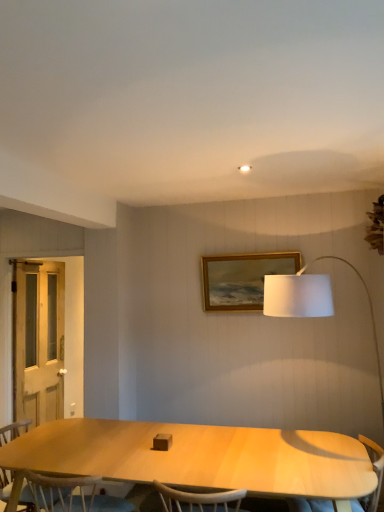
Question: Does point (26, 281) appear closer or farther from the camera than point (377, 457)?

Choices:
 (A) farther
 (B) closer

Answer: (A)

Question: From a real-world perspective, relative to light wood armchair at lower right, is white wooden screen door at left vertically above or below?

Choices:
 (A) below
 (B) above

Answer: (B)

Question: Which is nearer to the light wood armchair at lower right?

Choices:
 (A) gold wooden picture frame at upper center
 (B) light brown wood chair at lower left
 (C) white wooden screen door at left

Answer: (A)

Question: Which object is the closest to the light brown wood chair at lower left?

Choices:
 (A) light wood armchair at lower right
 (B) white wooden screen door at left
 (C) gold wooden picture frame at upper center

Answer: (B)